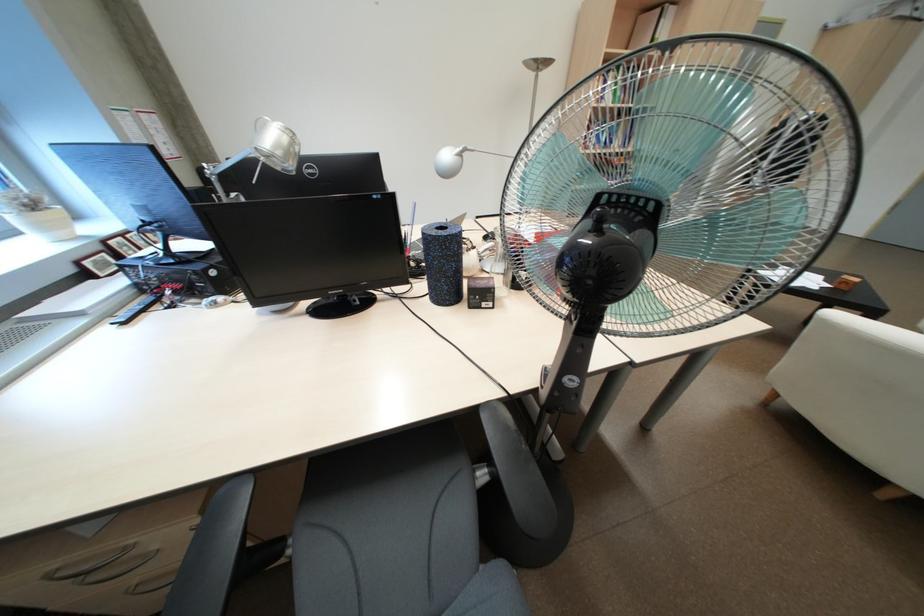
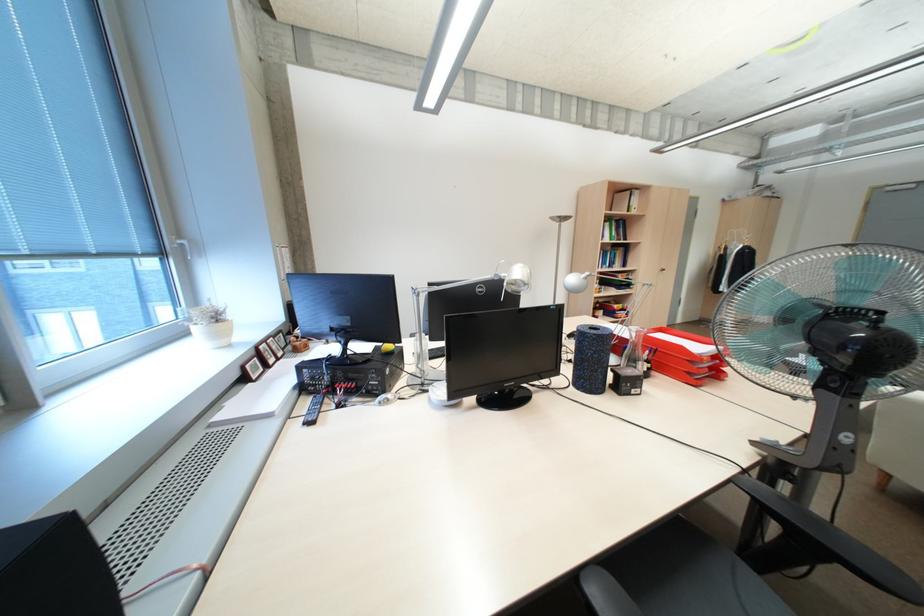
Question: In a continuous first-person perspective shot, in which direction is the camera moving?

Choices:
 (A) Left
 (B) Right
 (C) Forward
 (D) Backward

Answer: (A)